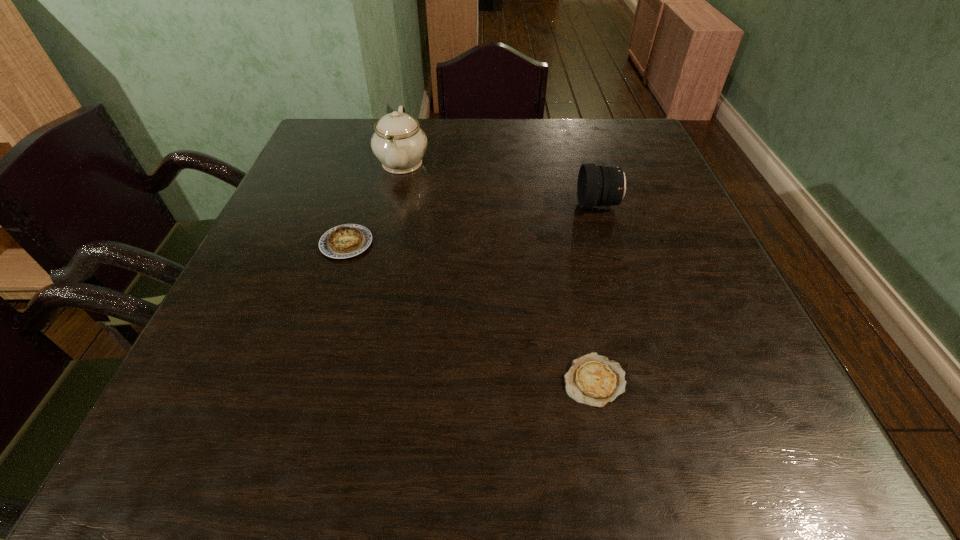
I want to click on vacant space at the right edge of the desktop, so click(x=696, y=333).

The image size is (960, 540). In the image, there is a desktop. What are the coordinates of `vacant space at the far left corner` in the screenshot? It's located at (360, 155).

I want to click on vacant region at the far right corner of the desktop, so click(595, 140).

Identify the location of vacant region at the near right corner of the desktop. Image resolution: width=960 pixels, height=540 pixels. (715, 439).

Find the location of a particular element. The image size is (960, 540). empty space between the farther quiche and the telephoto lens is located at coordinates (472, 224).

The image size is (960, 540). I want to click on free space between the left quiche and the third nearest object, so click(x=472, y=224).

Identify the location of vacant space in between the nearest object and the second nearest object. [470, 312].

Where is `free space between the second farthest object and the taller quiche`? This screenshot has width=960, height=540. free space between the second farthest object and the taller quiche is located at coordinates [472, 224].

Where is `vacant point located between the farthest object and the nearer quiche`? vacant point located between the farthest object and the nearer quiche is located at coordinates (498, 271).

At what (x,y) coordinates should I click in order to perform the action: click on blank region between the chinaware and the farther quiche. Please return your answer as a coordinate pair (x, y). Image resolution: width=960 pixels, height=540 pixels. Looking at the image, I should click on (374, 203).